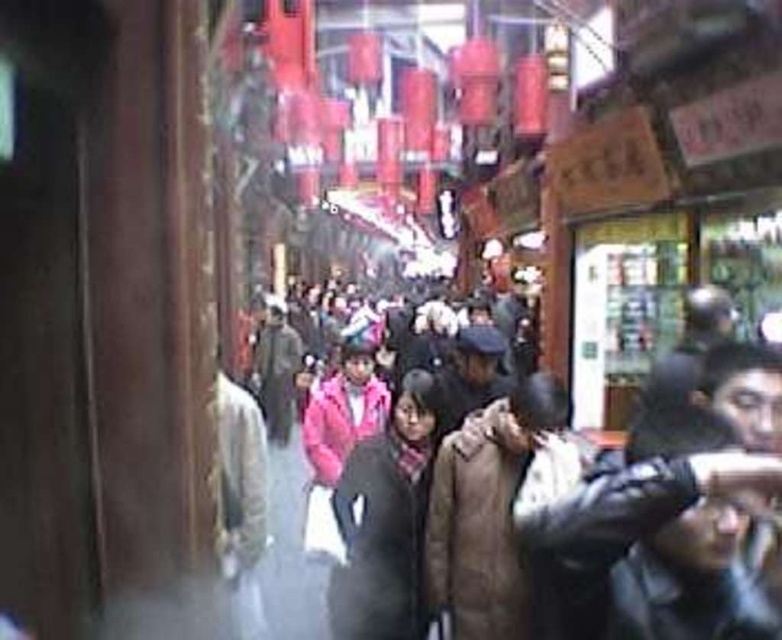
From the picture: Is dark brown down jacket at center to the left of dark gray fur coat at center from the viewer's perspective?

In fact, dark brown down jacket at center is to the right of dark gray fur coat at center.

Is dark brown down jacket at center in front of dark gray fur coat at center?

Yes.

Describe the element at coordinates (551, 538) in the screenshot. I see `dark brown down jacket at center` at that location.

Where is `dark brown down jacket at center`? Image resolution: width=782 pixels, height=640 pixels. dark brown down jacket at center is located at coordinates (551, 538).

Who is more forward, (526,449) or (371,490)?

Point (526,449) is in front.

Between point (436, 458) and point (415, 529), which one is positioned in front?

Point (415, 529) is more forward.

Where is `brown down jacket at center`? Image resolution: width=782 pixels, height=640 pixels. brown down jacket at center is located at coordinates (485, 509).

Consider the image. Does dark brown down jacket at center come in front of brown down jacket at center?

Yes, it is in front of brown down jacket at center.

Based on the photo, who is higher up, dark brown down jacket at center or brown down jacket at center?

dark brown down jacket at center is higher up.

Is point (565, 420) farther from viewer compared to point (481, 593)?

No, (565, 420) is closer to viewer.

This screenshot has width=782, height=640. Identify the location of dark brown down jacket at center. (551, 538).